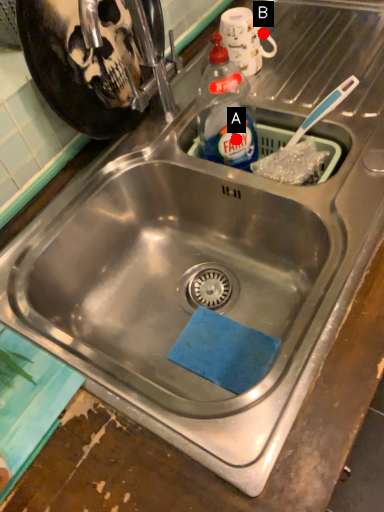
Question: Two points are circled on the image, labeled by A and B beside each circle. Which point appears farthest from the camera in this image?

Choices:
 (A) A is further
 (B) B is further

Answer: (B)